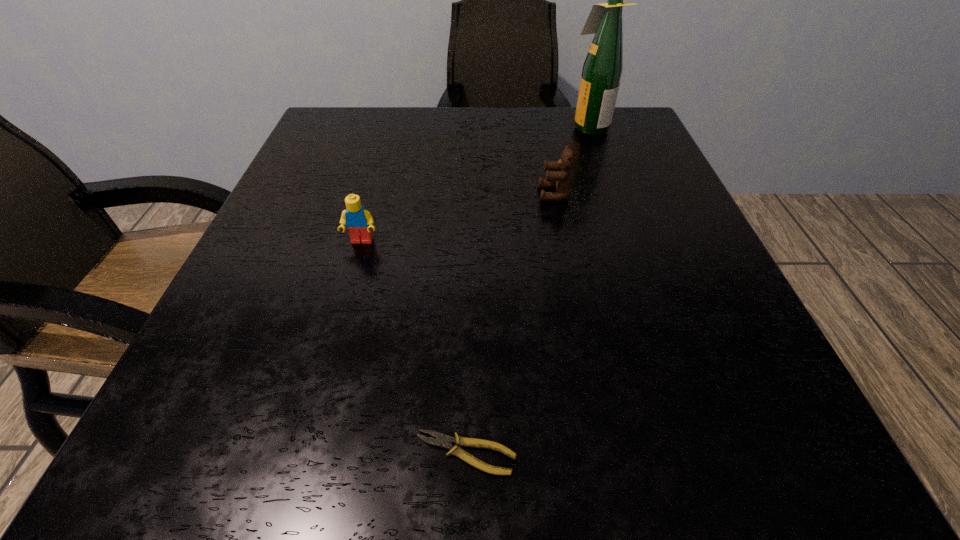
At what (x,y) coordinates should I click in order to perform the action: click on object at the far right corner. Please return your answer as a coordinate pair (x, y). The height and width of the screenshot is (540, 960). Looking at the image, I should click on (603, 66).

Where is `vacant region at the far edge`? The image size is (960, 540). vacant region at the far edge is located at coordinates (389, 148).

I want to click on vacant space at the near edge of the desktop, so click(360, 468).

In the image, there is a desktop. Identify the location of vacant space at the left edge. (346, 165).

Image resolution: width=960 pixels, height=540 pixels. In order to click on vacant space at the right edge of the desktop in this screenshot , I will do `click(698, 312)`.

At what (x,y) coordinates should I click in order to perform the action: click on vacant space at the far left corner of the desktop. Please return your answer as a coordinate pair (x, y). The width and height of the screenshot is (960, 540). Looking at the image, I should click on (354, 133).

Locate an element on the screen. Image resolution: width=960 pixels, height=540 pixels. free space at the near left corner of the desktop is located at coordinates click(x=245, y=460).

You are a GUI agent. You are given a task and a screenshot of the screen. Output one action in this format:
    pyautogui.click(x=<x>, y=<y>)
    Task: Click on the blank space at the far right corner of the desktop
    The height and width of the screenshot is (540, 960).
    Given the screenshot: What is the action you would take?
    pyautogui.click(x=603, y=151)

This screenshot has width=960, height=540. What are the coordinates of `free space between the tallest object and the pliers` in the screenshot? It's located at (527, 290).

Find the location of a particular element. vacant space in between the second object from left to right and the third farthest object is located at coordinates (414, 347).